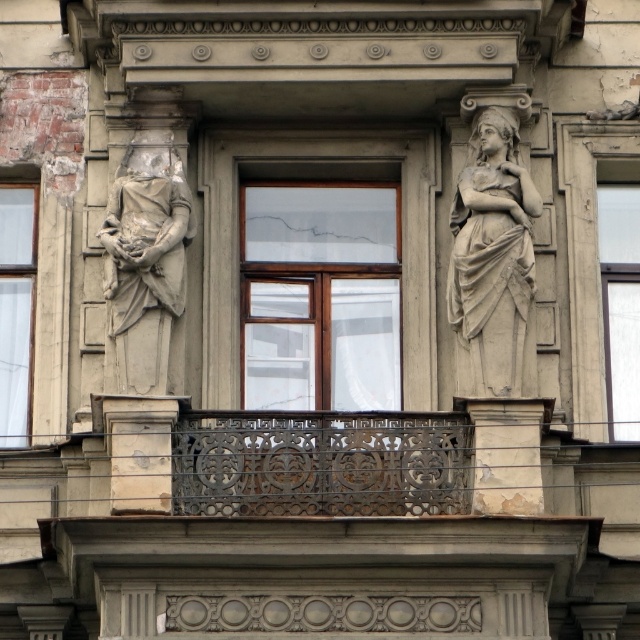
You are an architect analyzing the building facade. You need to place a new light fixture between the gray stone statue at right and the other statue. Which direction should you place it to ensure it is centered between them?

The gray stone statue at right is located at point (493, 257), so the light fixture should be placed midway between the two statues to ensure it is centered between them.